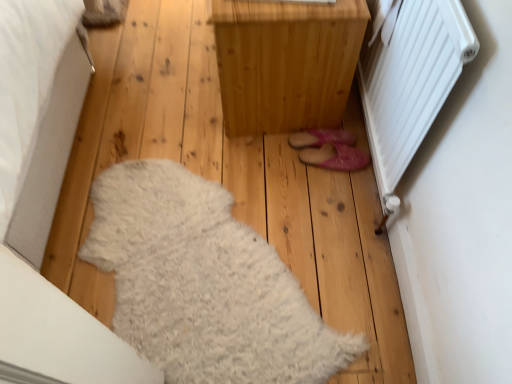
I want to click on unoccupied area in front of pink fuzzy slippers at center, so click(313, 203).